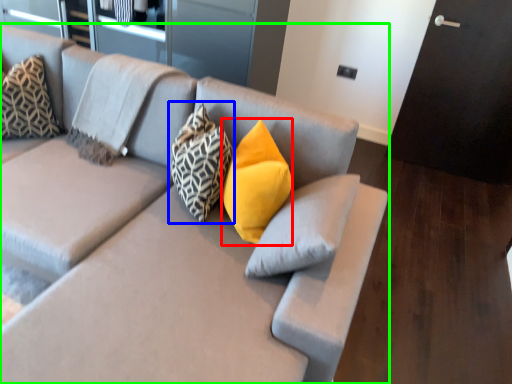
Question: Based on their relative distances, which object is nearer to pillow (highlighted by a red box)? Choose from pillow (highlighted by a blue box) and studio couch (highlighted by a green box).

Choices:
 (A) pillow
 (B) studio couch

Answer: (A)